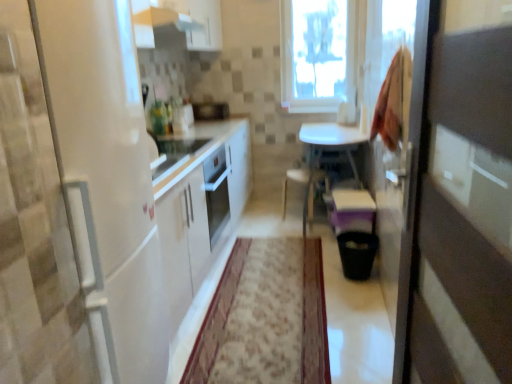
Question: From a real-world perspective, is white glossy table at center located beneath white glossy exhaust hood at upper center?

Choices:
 (A) yes
 (B) no

Answer: (A)

Question: Is white glossy table at center turned away from white glossy exhaust hood at upper center?

Choices:
 (A) no
 (B) yes

Answer: (A)

Question: Would you say white glossy table at center is outside white glossy exhaust hood at upper center?

Choices:
 (A) no
 (B) yes

Answer: (B)

Question: Is white glossy table at center positioned far away from white glossy exhaust hood at upper center?

Choices:
 (A) yes
 (B) no

Answer: (A)

Question: Can you confirm if white glossy table at center is shorter than white glossy exhaust hood at upper center?

Choices:
 (A) yes
 (B) no

Answer: (B)

Question: From the image's perspective, relative to wooden chair at center, is white glossy table at center above or below?

Choices:
 (A) above
 (B) below

Answer: (A)

Question: Is white glossy table at center wider or thinner than wooden chair at center?

Choices:
 (A) thin
 (B) wide

Answer: (B)

Question: From a real-world perspective, is white glossy table at center above or below wooden chair at center?

Choices:
 (A) above
 (B) below

Answer: (A)

Question: In the image, is white glossy table at center positioned in front of or behind wooden chair at center?

Choices:
 (A) front
 (B) behind

Answer: (A)

Question: In the image, is white glossy exhaust hood at upper center on the left side or the right side of white glossy refrigerator at left?

Choices:
 (A) left
 (B) right

Answer: (B)

Question: Is white glossy exhaust hood at upper center in front of or behind white glossy refrigerator at left in the image?

Choices:
 (A) behind
 (B) front

Answer: (A)

Question: In terms of height, does white glossy exhaust hood at upper center look taller or shorter compared to white glossy refrigerator at left?

Choices:
 (A) tall
 (B) short

Answer: (B)

Question: From the image's perspective, is white glossy exhaust hood at upper center located above or below white glossy refrigerator at left?

Choices:
 (A) below
 (B) above

Answer: (B)

Question: Is satin black microwave at center to the left or to the right of white glossy refrigerator at left in the image?

Choices:
 (A) right
 (B) left

Answer: (A)

Question: From the image's perspective, relative to white glossy refrigerator at left, is satin black microwave at center above or below?

Choices:
 (A) below
 (B) above

Answer: (B)